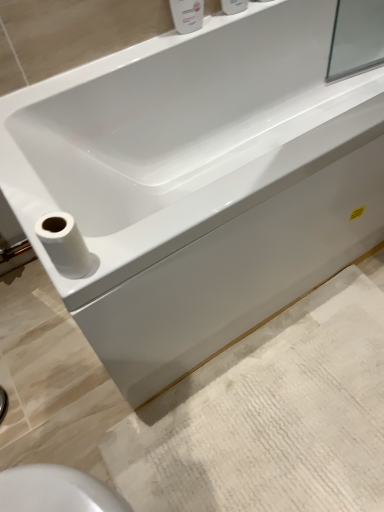
Image resolution: width=384 pixels, height=512 pixels. Describe the element at coordinates (64, 244) in the screenshot. I see `white matte toilet paper at lower left` at that location.

Measure the distance between point (70, 254) and camera.

The depth of point (70, 254) is 26.85 inches.

The width and height of the screenshot is (384, 512). What do you see at coordinates (187, 15) in the screenshot?
I see `white glossy soap dispenser at upper center, which is the 2th toiletry from right to left` at bounding box center [187, 15].

This screenshot has height=512, width=384. I want to click on white glossy soap dispenser at upper center, the first toiletry when ordered from left to right, so click(187, 15).

What do you see at coordinates (271, 415) in the screenshot? I see `white textured bath mat at lower right` at bounding box center [271, 415].

I want to click on white matte toilet paper at lower left, so click(64, 244).

Which of these two, white glossy bottle at upper center, which appears as the 2th toiletry when viewed from the left, or white glossy soap dispenser at upper center, the first toiletry when ordered from left to right, stands shorter?

With less height is white glossy bottle at upper center, which appears as the 2th toiletry when viewed from the left.

Locate an element on the screen. toiletry above the white glossy soap dispenser at upper center, which is the 2th toiletry from right to left (from a real-world perspective) is located at coordinates (233, 6).

From the picture: Does white glossy bottle at upper center, which appears as the 2th toiletry when viewed from the left, come in front of white glossy soap dispenser at upper center, which is the 2th toiletry from right to left?

No, white glossy bottle at upper center, which appears as the 2th toiletry when viewed from the left, is further to the viewer.

From their relative heights in the image, would you say white textured bath mat at lower right is taller or shorter than white matte toilet paper at lower left?

Considering their sizes, white textured bath mat at lower right has less height than white matte toilet paper at lower left.

Can you confirm if white textured bath mat at lower right is positioned to the left of white matte toilet paper at lower left?

No.

Is white textured bath mat at lower right completely or partially outside of white matte toilet paper at lower left?

Yes, white textured bath mat at lower right is located beyond the bounds of white matte toilet paper at lower left.

From a real-world perspective, which object stands above the other?

white matte toilet paper at lower left, from a real-world perspective.

Is white glossy soap dispenser at upper center, the first toiletry when ordered from left to right, far from white glossy bottle at upper center, the 1th toiletry viewed from the right?

white glossy soap dispenser at upper center, the first toiletry when ordered from left to right, is near white glossy bottle at upper center, the 1th toiletry viewed from the right, not far away.

How many degrees apart are the facing directions of white glossy soap dispenser at upper center, which is the 2th toiletry from right to left, and white glossy bottle at upper center, the 1th toiletry viewed from the right?

0.00316 degrees separate the facing orientations of white glossy soap dispenser at upper center, which is the 2th toiletry from right to left, and white glossy bottle at upper center, the 1th toiletry viewed from the right.

Which is in front, white glossy soap dispenser at upper center, the first toiletry when ordered from left to right, or white glossy bottle at upper center, the 1th toiletry viewed from the right?

white glossy soap dispenser at upper center, the first toiletry when ordered from left to right, is in front.

Locate an element on the screen. This screenshot has height=512, width=384. toiletry that is the 1st object above the white matte toilet paper at lower left (from a real-world perspective) is located at coordinates (187, 15).

Looking at this image, in terms of size, does white glossy soap dispenser at upper center, which is the 2th toiletry from right to left, appear bigger or smaller than white matte toilet paper at lower left?

white glossy soap dispenser at upper center, which is the 2th toiletry from right to left, is bigger than white matte toilet paper at lower left.

Is white glossy soap dispenser at upper center, the first toiletry when ordered from left to right, turned away from white matte toilet paper at lower left?

white glossy soap dispenser at upper center, the first toiletry when ordered from left to right, is not turned away from white matte toilet paper at lower left.

Is the position of white glossy soap dispenser at upper center, which is the 2th toiletry from right to left, more distant than that of white matte toilet paper at lower left?

Yes, the depth of white glossy soap dispenser at upper center, which is the 2th toiletry from right to left, is greater than that of white matte toilet paper at lower left.

Can white textured bath mat at lower right be found inside white glossy bottle at upper center, the 1th toiletry viewed from the right?

No, white textured bath mat at lower right is not inside white glossy bottle at upper center, the 1th toiletry viewed from the right.

Does point (232, 0) appear closer or farther from the camera than point (256, 399)?

Point (232, 0) is farther from the camera than point (256, 399).

From the image's perspective, is white glossy bottle at upper center, which appears as the 2th toiletry when viewed from the left, beneath white textured bath mat at lower right?

Actually, white glossy bottle at upper center, which appears as the 2th toiletry when viewed from the left, appears above white textured bath mat at lower right in the image.

Can you confirm if white glossy bottle at upper center, which appears as the 2th toiletry when viewed from the left, is taller than white textured bath mat at lower right?

Yes, white glossy bottle at upper center, which appears as the 2th toiletry when viewed from the left, is taller than white textured bath mat at lower right.

Considering the relative sizes of white matte toilet paper at lower left and white glossy soap dispenser at upper center, which is the 2th toiletry from right to left, in the image provided, is white matte toilet paper at lower left shorter than white glossy soap dispenser at upper center, which is the 2th toiletry from right to left,?

Indeed, white matte toilet paper at lower left has a lesser height compared to white glossy soap dispenser at upper center, which is the 2th toiletry from right to left.

Which is closer, (42, 224) or (199, 15)?

Point (42, 224) appears to be closer to the viewer than point (199, 15).

Is white matte toilet paper at lower left in front of or behind white glossy soap dispenser at upper center, which is the 2th toiletry from right to left, in the image?

Visually, white matte toilet paper at lower left is located in front of white glossy soap dispenser at upper center, which is the 2th toiletry from right to left.

Considering the sizes of objects white matte toilet paper at lower left and white glossy soap dispenser at upper center, the first toiletry when ordered from left to right, in the image provided, who is thinner, white matte toilet paper at lower left or white glossy soap dispenser at upper center, the first toiletry when ordered from left to right,?

white glossy soap dispenser at upper center, the first toiletry when ordered from left to right.

From a real-world perspective, is white glossy soap dispenser at upper center, which is the 2th toiletry from right to left, positioned above or below white textured bath mat at lower right?

Clearly, from a real-world perspective, white glossy soap dispenser at upper center, which is the 2th toiletry from right to left, is above white textured bath mat at lower right.

Considering the positions of points (193, 24) and (357, 355), is point (193, 24) closer to camera compared to point (357, 355)?

No, (193, 24) is behind (357, 355).

Where is `bath mat that is under the white glossy soap dispenser at upper center, which is the 2th toiletry from right to left (from a real-world perspective)`? bath mat that is under the white glossy soap dispenser at upper center, which is the 2th toiletry from right to left (from a real-world perspective) is located at coordinates (x=271, y=415).

In the scene shown: Considering the relative sizes of white glossy soap dispenser at upper center, which is the 2th toiletry from right to left, and white textured bath mat at lower right in the image provided, is white glossy soap dispenser at upper center, which is the 2th toiletry from right to left, wider than white textured bath mat at lower right?

In fact, white glossy soap dispenser at upper center, which is the 2th toiletry from right to left, might be narrower than white textured bath mat at lower right.

The height and width of the screenshot is (512, 384). Identify the location of toiletry located on the right of white glossy soap dispenser at upper center, the first toiletry when ordered from left to right. (233, 6).

The height and width of the screenshot is (512, 384). What are the coordinates of `toilet paper in front of the white textured bath mat at lower right` in the screenshot? It's located at (64, 244).

Based on their spatial positions, is white textured bath mat at lower right or white glossy bottle at upper center, which appears as the 2th toiletry when viewed from the left, further from white matte toilet paper at lower left?

white glossy bottle at upper center, which appears as the 2th toiletry when viewed from the left.

Looking at the image, which one is located closer to white glossy soap dispenser at upper center, which is the 2th toiletry from right to left, white textured bath mat at lower right or white glossy bottle at upper center, which appears as the 2th toiletry when viewed from the left?

Among the two, white glossy bottle at upper center, which appears as the 2th toiletry when viewed from the left, is located nearer to white glossy soap dispenser at upper center, which is the 2th toiletry from right to left.

Estimate the real-world distances between objects in this image. Which object is further from white textured bath mat at lower right, white matte toilet paper at lower left or white glossy soap dispenser at upper center, the first toiletry when ordered from left to right?

Among the two, white glossy soap dispenser at upper center, the first toiletry when ordered from left to right, is located further to white textured bath mat at lower right.

Based on their spatial positions, is white glossy soap dispenser at upper center, the first toiletry when ordered from left to right, or white matte toilet paper at lower left closer to white glossy bottle at upper center, which appears as the 2th toiletry when viewed from the left?

Based on the image, white glossy soap dispenser at upper center, the first toiletry when ordered from left to right, appears to be nearer to white glossy bottle at upper center, which appears as the 2th toiletry when viewed from the left.

When comparing their distances from white matte toilet paper at lower left, does white glossy soap dispenser at upper center, which is the 2th toiletry from right to left, or white textured bath mat at lower right seem further?

The object further to white matte toilet paper at lower left is white glossy soap dispenser at upper center, which is the 2th toiletry from right to left.

Considering their positions, is white glossy bottle at upper center, which appears as the 2th toiletry when viewed from the left, positioned further to white textured bath mat at lower right than white matte toilet paper at lower left?

Based on the image, white glossy bottle at upper center, which appears as the 2th toiletry when viewed from the left, appears to be further to white textured bath mat at lower right.

Looking at the image, which one is located further to white glossy soap dispenser at upper center, the first toiletry when ordered from left to right, white matte toilet paper at lower left or white textured bath mat at lower right?

white textured bath mat at lower right lies further to white glossy soap dispenser at upper center, the first toiletry when ordered from left to right, than the other object.

From the image, which object appears to be farther from white textured bath mat at lower right, white glossy soap dispenser at upper center, the first toiletry when ordered from left to right, or white matte toilet paper at lower left?

white glossy soap dispenser at upper center, the first toiletry when ordered from left to right, is positioned further to the anchor white textured bath mat at lower right.

This screenshot has width=384, height=512. What are the coordinates of `toilet paper between white glossy soap dispenser at upper center, the first toiletry when ordered from left to right, and white textured bath mat at lower right from top to bottom` in the screenshot? It's located at (64, 244).

Where is `toiletry between white glossy bottle at upper center, which appears as the 2th toiletry when viewed from the left, and white matte toilet paper at lower left vertically`? toiletry between white glossy bottle at upper center, which appears as the 2th toiletry when viewed from the left, and white matte toilet paper at lower left vertically is located at coordinates (187, 15).

Where is `toiletry between white glossy bottle at upper center, which appears as the 2th toiletry when viewed from the left, and white textured bath mat at lower right in the up-down direction`? toiletry between white glossy bottle at upper center, which appears as the 2th toiletry when viewed from the left, and white textured bath mat at lower right in the up-down direction is located at coordinates (187, 15).

Locate an element on the screen. toilet paper between white glossy bottle at upper center, which appears as the 2th toiletry when viewed from the left, and white textured bath mat at lower right, in the vertical direction is located at coordinates (64, 244).